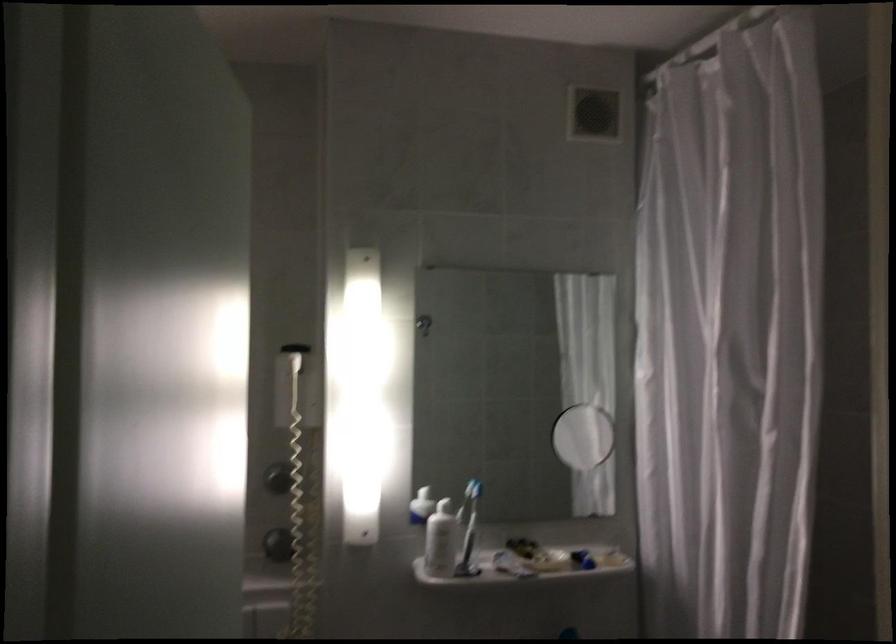
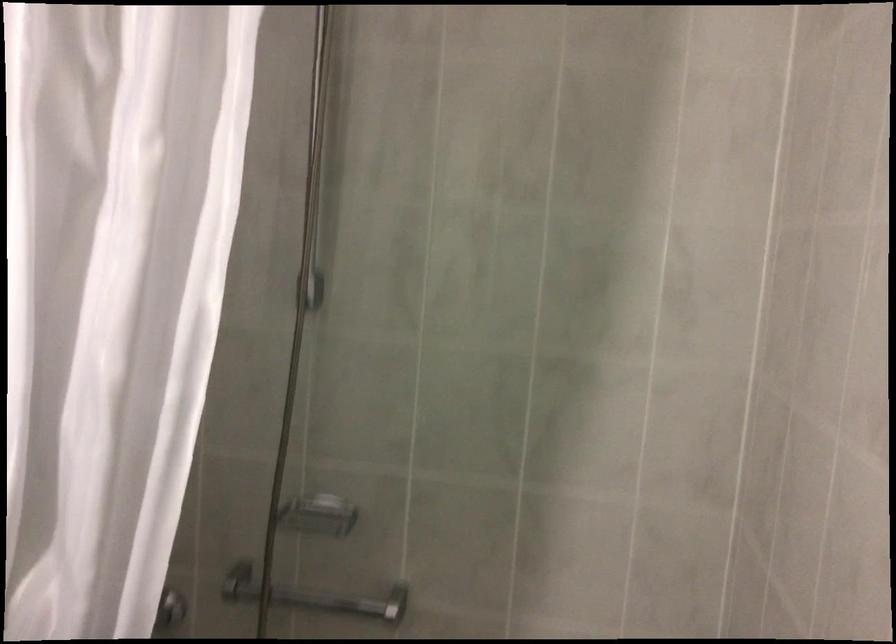
Question: The camera is either moving clockwise (left) or counter-clockwise (right) around the object. The first image is from the beginning of the video and the second image is from the end. Is the camera moving left or right when shooting the video?

Choices:
 (A) Left
 (B) Right

Answer: (A)